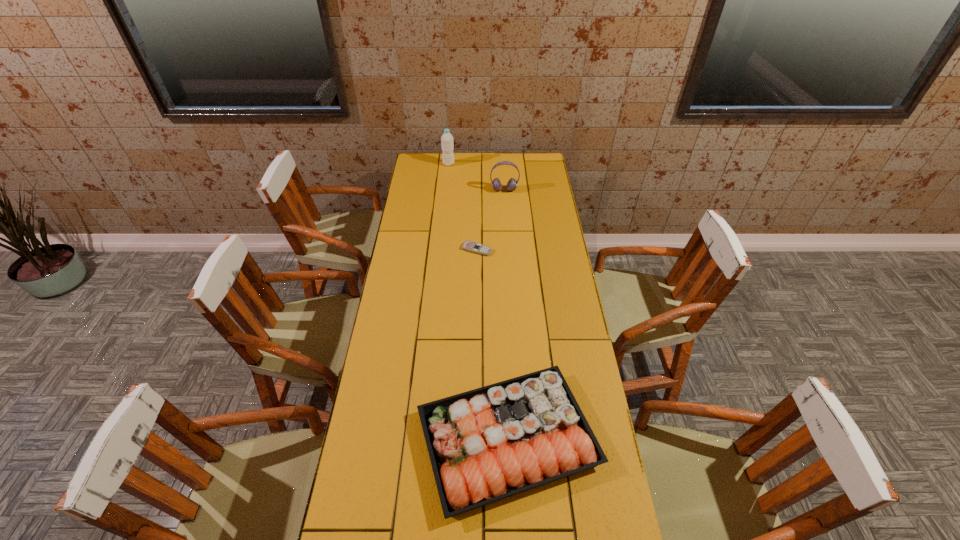
Where is `the tallest object`? the tallest object is located at coordinates (x=447, y=143).

You are a GUI agent. You are given a task and a screenshot of the screen. Output one action in this format:
    pyautogui.click(x=<x>, y=<y>)
    Task: Click on the water bottle
    This screenshot has height=540, width=960.
    Given the screenshot: What is the action you would take?
    pyautogui.click(x=447, y=143)

Locate an element on the screen. The width and height of the screenshot is (960, 540). headset is located at coordinates (512, 183).

I want to click on the third shortest object, so click(x=512, y=183).

You are a GUI agent. You are given a task and a screenshot of the screen. Output one action in this format:
    pyautogui.click(x=<x>, y=<y>)
    Task: Click on the platter
    The width and height of the screenshot is (960, 540).
    Given the screenshot: What is the action you would take?
    pyautogui.click(x=487, y=444)

Where is `the nearest object`? The width and height of the screenshot is (960, 540). the nearest object is located at coordinates (487, 444).

Locate an element on the screen. remote control is located at coordinates (474, 247).

At what (x,y) coordinates should I click in order to perform the action: click on the shortest object. Please return your answer as a coordinate pair (x, y). Looking at the image, I should click on (474, 247).

Image resolution: width=960 pixels, height=540 pixels. What are the coordinates of `free space located on the right of the tallest object` in the screenshot? It's located at (472, 164).

Locate an element on the screen. The image size is (960, 540). free point located on the headband and ear cups of the headset is located at coordinates (507, 235).